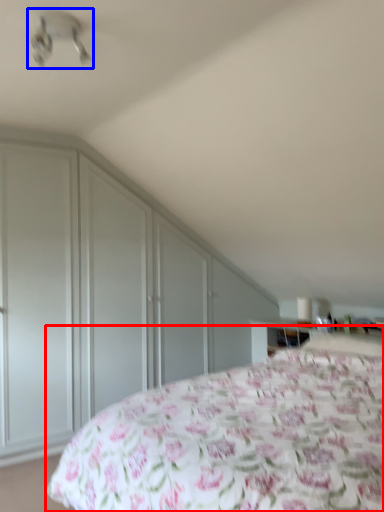
Question: Which of the following is the closest to the observer, bed (highlighted by a red box) or fan (highlighted by a blue box)?

Choices:
 (A) bed
 (B) fan

Answer: (A)